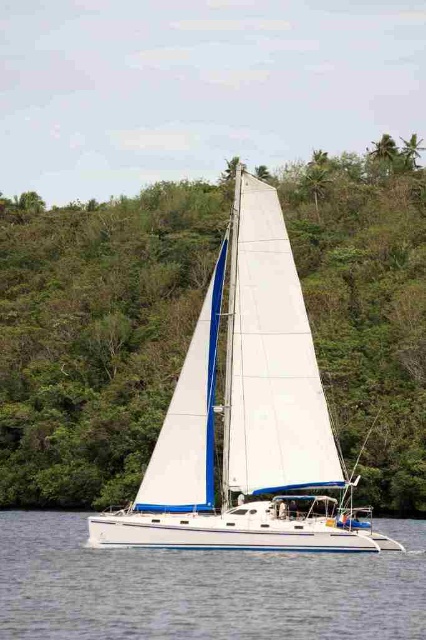
Question: Which point is farther to the camera?

Choices:
 (A) white glossy water at center
 (B) white matte sailboat at center

Answer: (B)

Question: Is white matte sailboat at center closer to camera compared to white glossy water at center?

Choices:
 (A) no
 (B) yes

Answer: (A)

Question: Is white matte sailboat at center below white glossy water at center?

Choices:
 (A) no
 (B) yes

Answer: (A)

Question: Can you confirm if white matte sailboat at center is positioned to the right of white glossy water at center?

Choices:
 (A) yes
 (B) no

Answer: (A)

Question: Which object is farther from the camera taking this photo?

Choices:
 (A) white glossy water at center
 (B) white matte sailboat at center

Answer: (B)

Question: Which point is farther to the camera?

Choices:
 (A) white matte sailboat at center
 (B) white glossy water at center

Answer: (A)